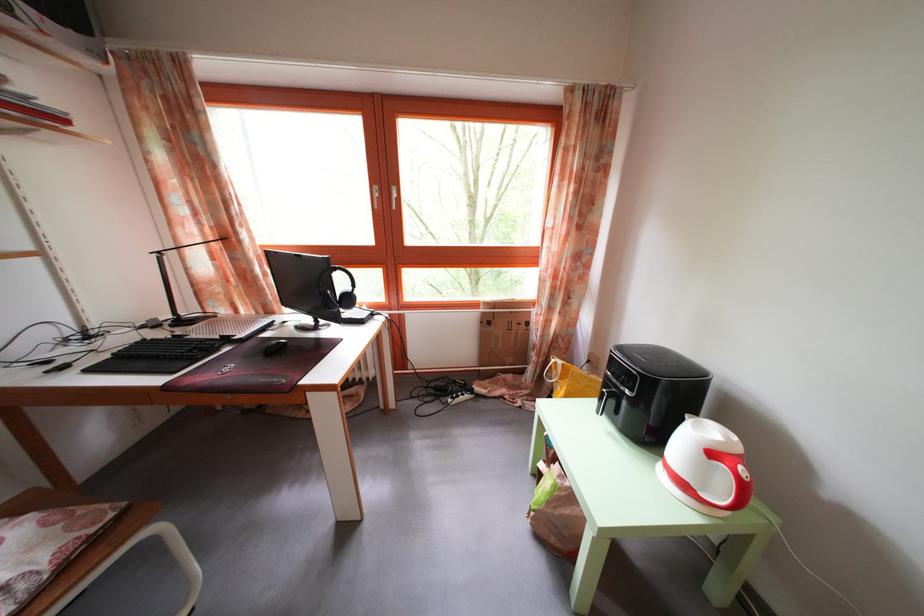
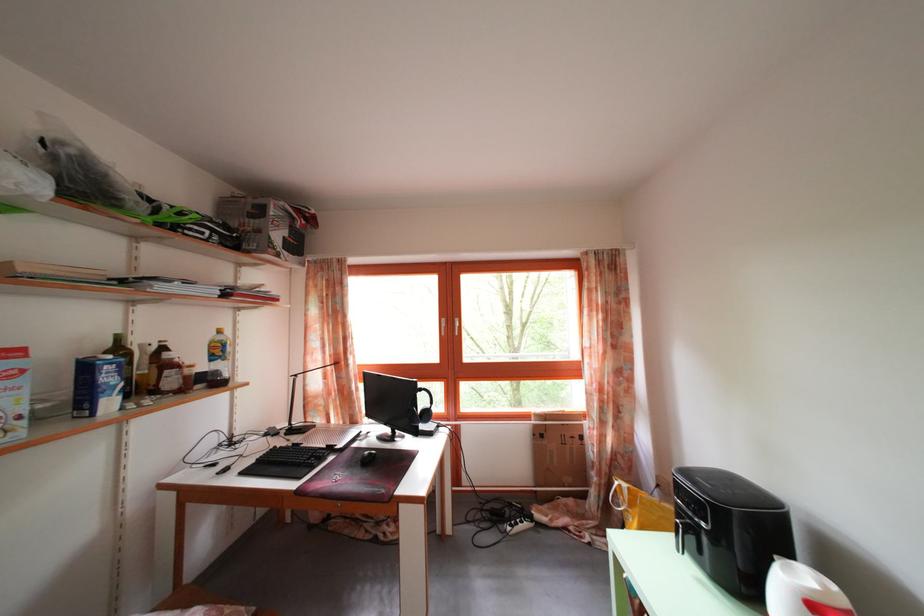
Where in the second image is the point corresponding to pixel 343 276 from the first image?

(428, 397)